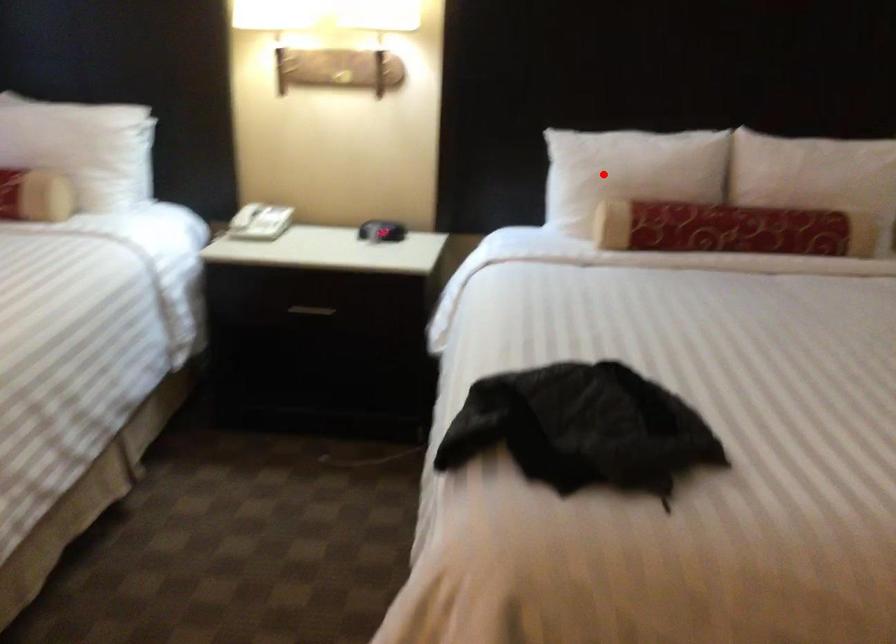
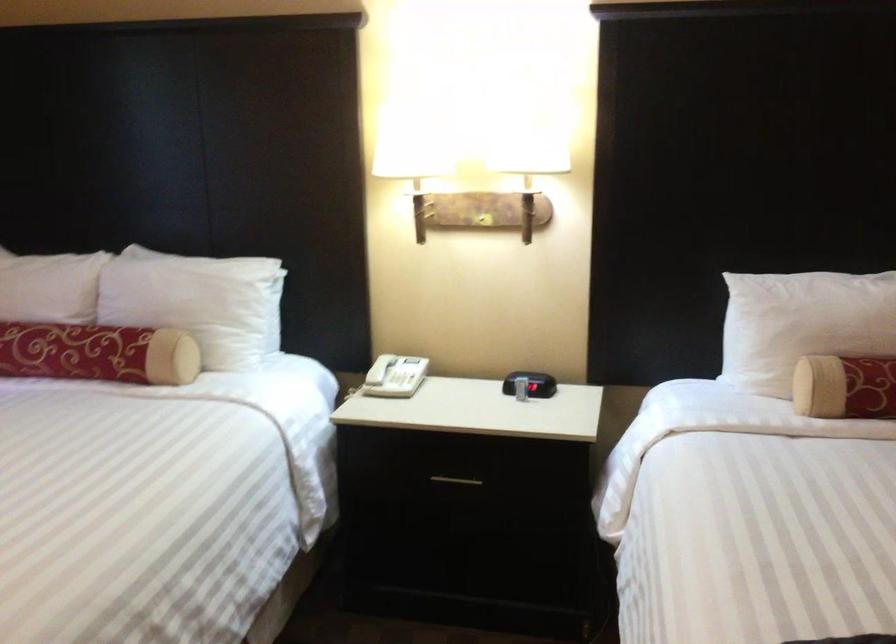
Question: I am providing you with two images of the same scene from different viewpoints. Image1 has a red point marked. In image2, the corresponding 3D location appears at what relative position? Reply with the corresponding letter.

Choices:
 (A) Closer
 (B) Farther

Answer: (A)